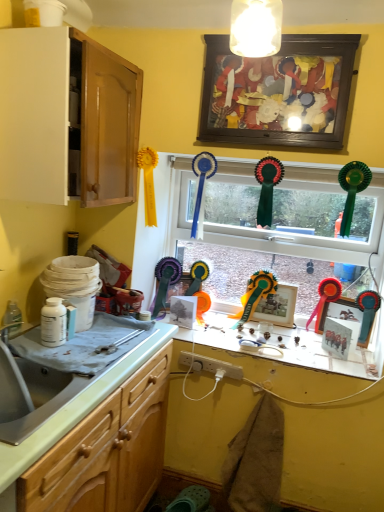
This screenshot has height=512, width=384. I want to click on vacant space to the right of matte paper picture frame at center, the third picture frame in the bottom-to-top sequence, so click(216, 334).